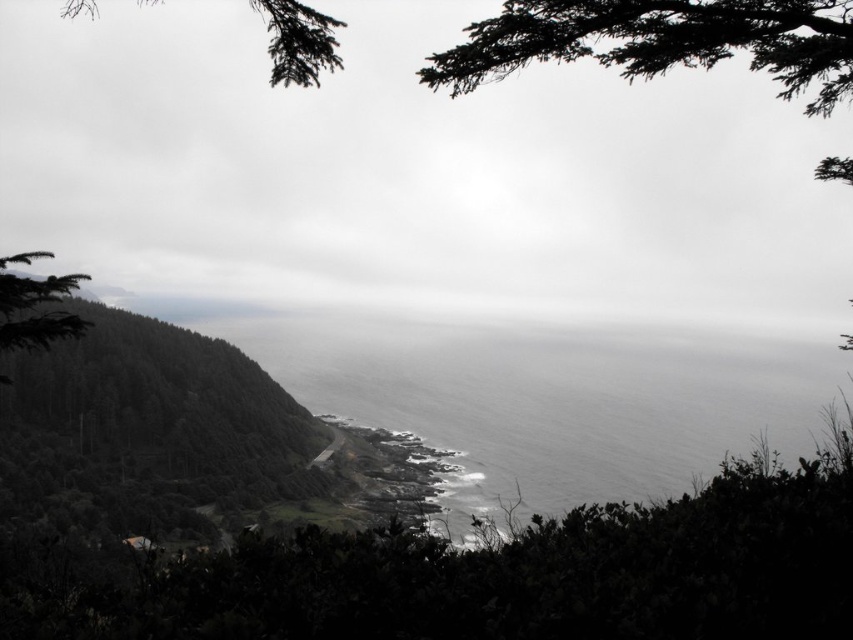
Question: Which point is closer to the camera taking this photo?

Choices:
 (A) (7, 349)
 (B) (517, 384)

Answer: (A)

Question: Where is gray matte water at center located in relation to green matte tree at upper left in the image?

Choices:
 (A) right
 (B) left

Answer: (A)

Question: Considering the relative positions of gray matte water at center and green matte tree at upper left in the image provided, where is gray matte water at center located with respect to green matte tree at upper left?

Choices:
 (A) above
 (B) below

Answer: (B)

Question: Which of the following is the farthest from the observer?

Choices:
 (A) green matte tree at upper left
 (B) gray matte water at center

Answer: (B)

Question: Can you confirm if gray matte water at center is thinner than green matte tree at upper left?

Choices:
 (A) yes
 (B) no

Answer: (B)